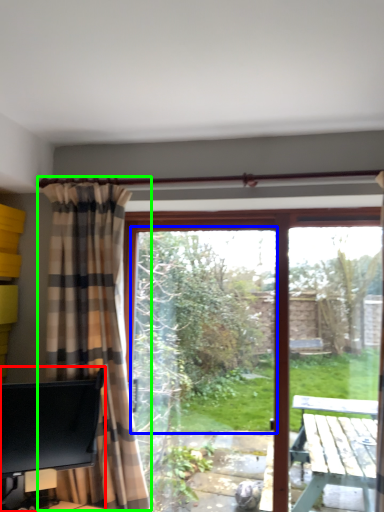
Question: Considering the real-world distances, which object is closest to desk (highlighted by a red box)? window screen (highlighted by a blue box) or curtain (highlighted by a green box).

Choices:
 (A) window screen
 (B) curtain

Answer: (B)